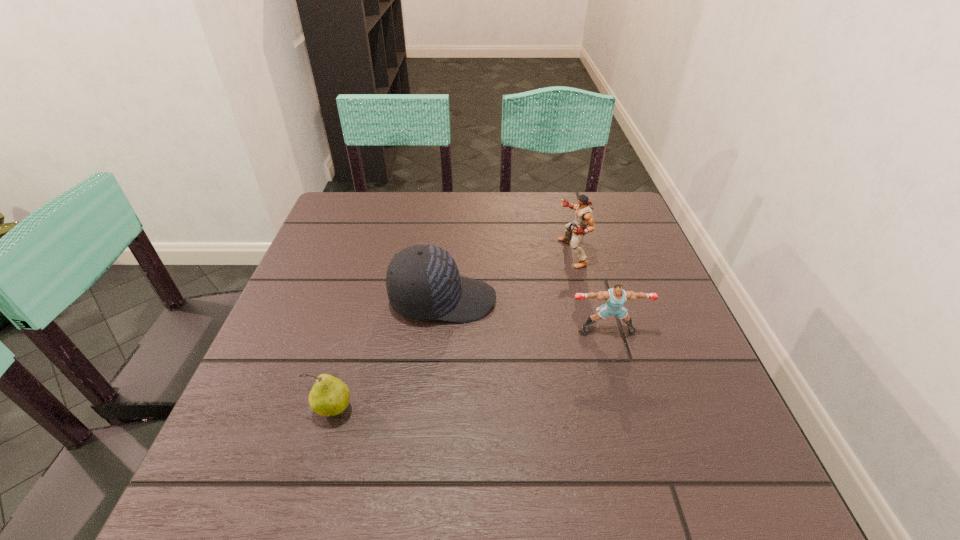
Where is `vacant region at the near left corner of the desktop`? vacant region at the near left corner of the desktop is located at coordinates (259, 475).

You are a GUI agent. You are given a task and a screenshot of the screen. Output one action in this format:
    pyautogui.click(x=<x>, y=<y>)
    Task: Click on the free space at the far right corner of the desktop
    
    Given the screenshot: What is the action you would take?
    pyautogui.click(x=623, y=235)

You are a GUI agent. You are given a task and a screenshot of the screen. Output one action in this format:
    pyautogui.click(x=<x>, y=<y>)
    Task: Click on the vacant area that lies between the nearest object and the tallest object
    This screenshot has width=960, height=540.
    Given the screenshot: What is the action you would take?
    pyautogui.click(x=452, y=331)

The width and height of the screenshot is (960, 540). Identify the location of free spot between the shortest object and the third object from right to left. (388, 355).

You are a GUI agent. You are given a task and a screenshot of the screen. Output one action in this format:
    pyautogui.click(x=<x>, y=<y>)
    Task: Click on the blank region between the shortest object and the baseball cap
    This screenshot has height=540, width=960.
    Given the screenshot: What is the action you would take?
    pyautogui.click(x=388, y=355)

Where is `free space between the baseball cap and the shorter puncher`? The image size is (960, 540). free space between the baseball cap and the shorter puncher is located at coordinates (525, 314).

Where is `free spot between the shorter puncher and the baseball cap`? Image resolution: width=960 pixels, height=540 pixels. free spot between the shorter puncher and the baseball cap is located at coordinates (525, 314).

At what (x,y) coordinates should I click in order to perform the action: click on blank region between the tallest object and the baseball cap. Please return your answer as a coordinate pair (x, y). Image resolution: width=960 pixels, height=540 pixels. Looking at the image, I should click on (507, 276).

Find the location of a particular element. The width and height of the screenshot is (960, 540). free spot between the second object from left to right and the leftmost object is located at coordinates (388, 355).

Identify the location of vacant area that lies between the tallest object and the baseball cap. The height and width of the screenshot is (540, 960). (507, 276).